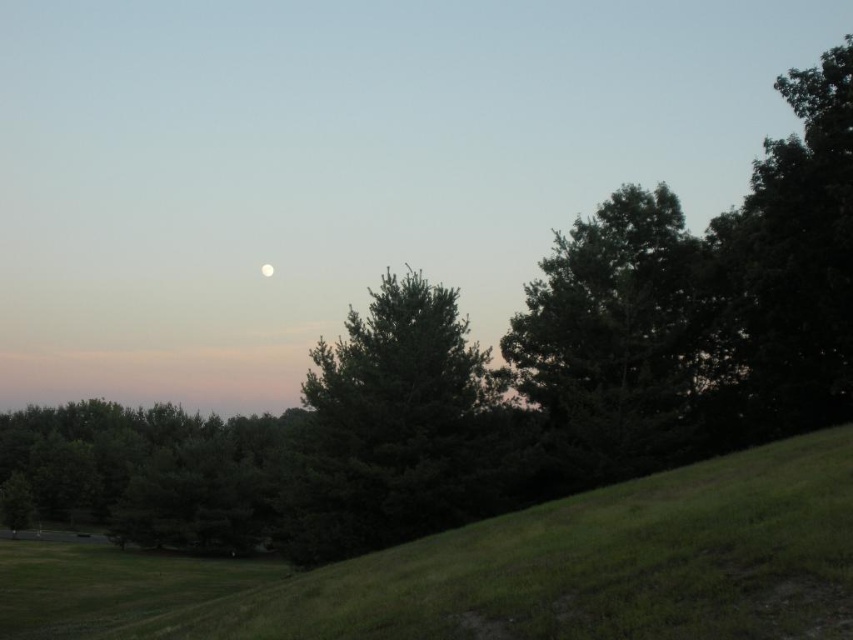
Question: Which of these objects is positioned closest to the white glossy moon at upper center?

Choices:
 (A) dark green leafy tree at right
 (B) green leafy tree at center
 (C) green grassy hill at lower center
 (D) green matte tree at center

Answer: (B)

Question: Which point appears farthest from the camera in this image?

Choices:
 (A) (126, 513)
 (B) (611, 296)
 (C) (814, 205)
 (D) (387, 392)

Answer: (A)

Question: Is dark green leafy tree at right positioned in front of green leafy tree at center?

Choices:
 (A) no
 (B) yes

Answer: (B)

Question: Which of the following is the farthest from the observer?

Choices:
 (A) (61, 500)
 (B) (260, 269)
 (C) (660, 339)
 (D) (302, 529)

Answer: (B)

Question: Is green matte tree at center closer to the viewer compared to dark green leafy tree at right?

Choices:
 (A) no
 (B) yes

Answer: (B)

Question: Does dark green leafy tree at right appear on the right side of white glossy moon at upper center?

Choices:
 (A) yes
 (B) no

Answer: (A)